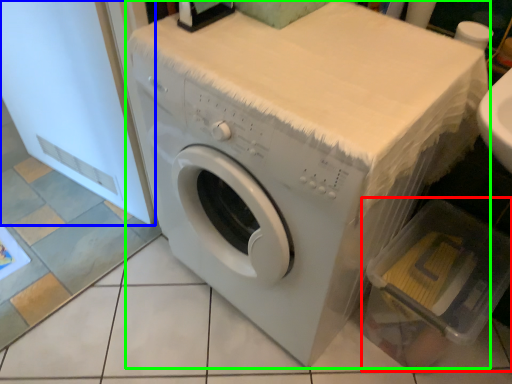
Question: Which object is the closest to the dish washer (highlighted by a red box)? Choose among these: screen door (highlighted by a blue box) or washing machine (highlighted by a green box).

Choices:
 (A) screen door
 (B) washing machine

Answer: (B)